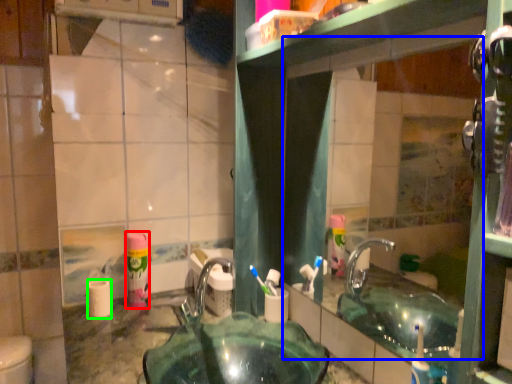
Question: Which is farther away from mouthwash (highlighted by a red box)? mirror (highlighted by a blue box) or toilet paper (highlighted by a green box)?

Choices:
 (A) mirror
 (B) toilet paper

Answer: (A)